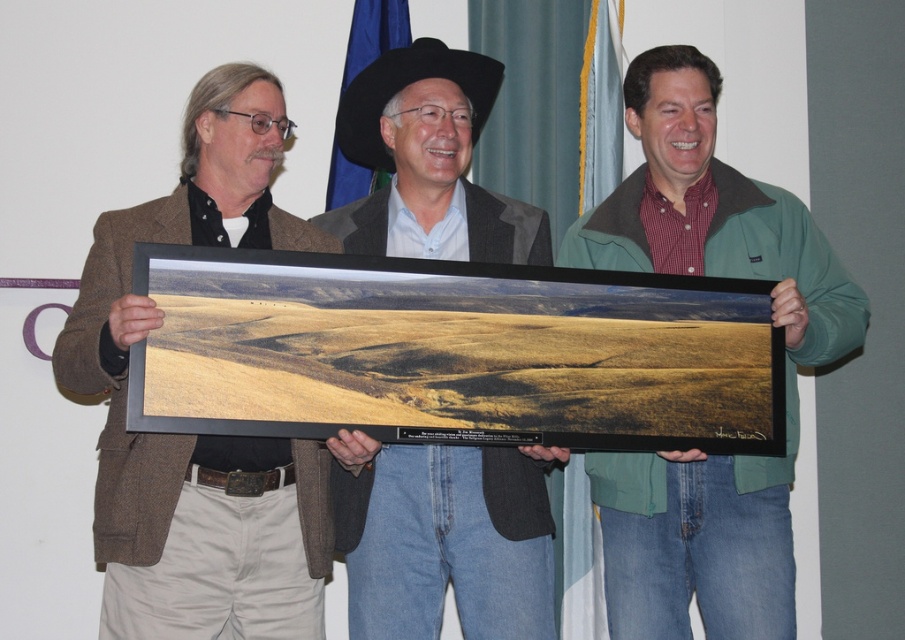
Question: Which point appears closest to the camera in this image?

Choices:
 (A) (384, 536)
 (B) (462, 92)
 (C) (206, 164)
 (D) (761, 515)

Answer: (C)

Question: Which point is farther to the camera?

Choices:
 (A) (718, 513)
 (B) (170, 477)

Answer: (A)

Question: Considering the relative positions of green textured jacket at center and black felt cowboy hat at center in the image provided, where is green textured jacket at center located with respect to black felt cowboy hat at center?

Choices:
 (A) above
 (B) below

Answer: (B)

Question: Which object is positioned farthest from the black felt cowboy hat at center?

Choices:
 (A) matte black cowboy hat at center
 (B) green textured jacket at center

Answer: (B)

Question: Is brown woolen jacket at left further to the viewer compared to green textured jacket at center?

Choices:
 (A) yes
 (B) no

Answer: (B)

Question: Is green textured jacket at center bigger than matte black cowboy hat at center?

Choices:
 (A) no
 (B) yes

Answer: (B)